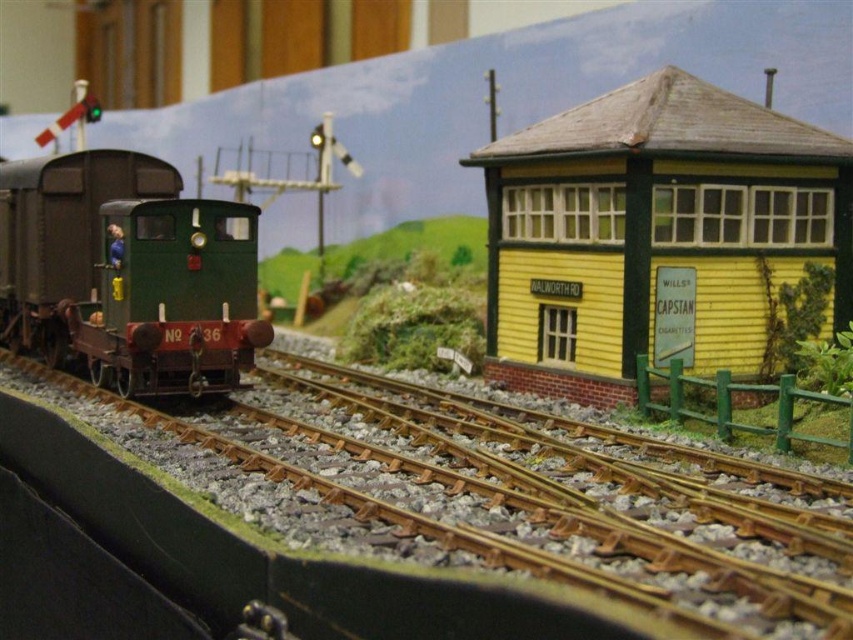
You are a model train enthusiast who wants to place a new model of the matte green locomotive at left onto the brown gravel train track at center. Based on the scene description, will the new locomotive fit on the track?

The brown gravel train track at center has a larger size compared to the matte green locomotive at left, so the new locomotive should fit on the track since the track is bigger in size.

You are a model train enthusiast who wants to place a new locomotive on the brown gravel train track at center. However, there is a yellow wood railway station at right nearby. Based on the scene description, can you safely place the locomotive on the track without it being blocked by the station?

The brown gravel train track at center is positioned under the yellow wood railway station at right, so placing the locomotive on the track would place it directly underneath the station. This means the locomotive would be blocked by the station and unable to move freely. Choose another section of track that is not under the station.